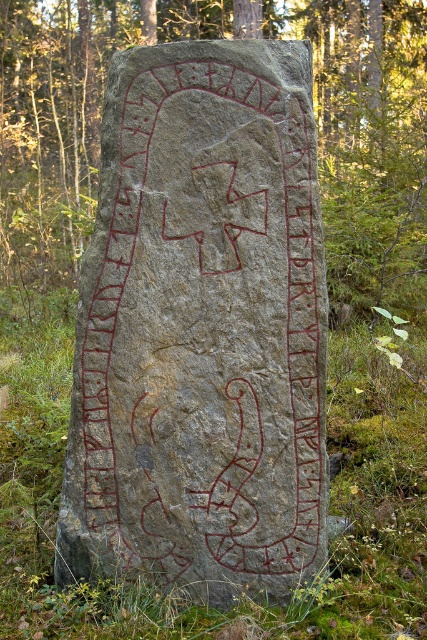
You are standing in front of the runestone and want to touch the point at coordinates (198,556). Is this point within arm reach? Assume your arm can reach up to 2.5 feet.

The point at (198,556) is 6.32 feet away from you, which is beyond your arm reach of 2.5 feet. You cannot touch it.

You are an archaeologist examining the runestone. You notice a point marked at coordinates (201,326). What does this point indicate?

The point at coordinates (201,326) indicates the gray stone at center.

You are an archaeologist examining the gray stone at center and the gray stone carving at center. Which object has a smaller width?

The gray stone at center has a lesser width compared to the gray stone carving at center.